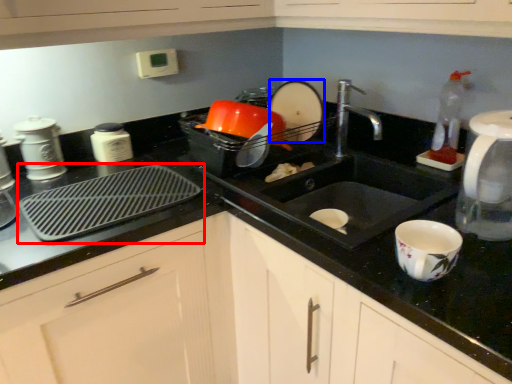
Question: Which point is further to the camera, kitchen appliance (highlighted by a red box) or appliance (highlighted by a blue box)?

Choices:
 (A) kitchen appliance
 (B) appliance

Answer: (B)